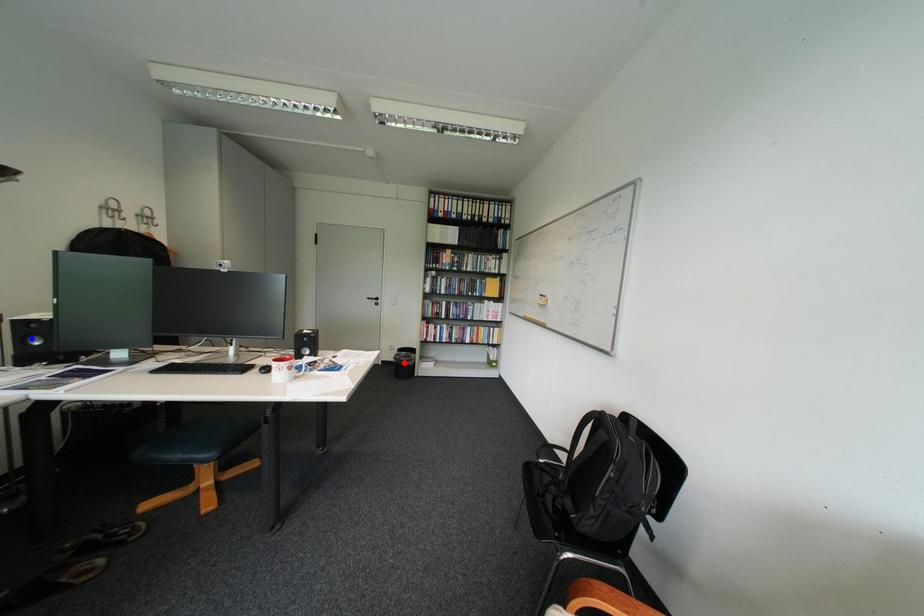
Question: Which of the two points in the image is closer to the camera?

Choices:
 (A) Blue point is closer.
 (B) Red point is closer.

Answer: (A)